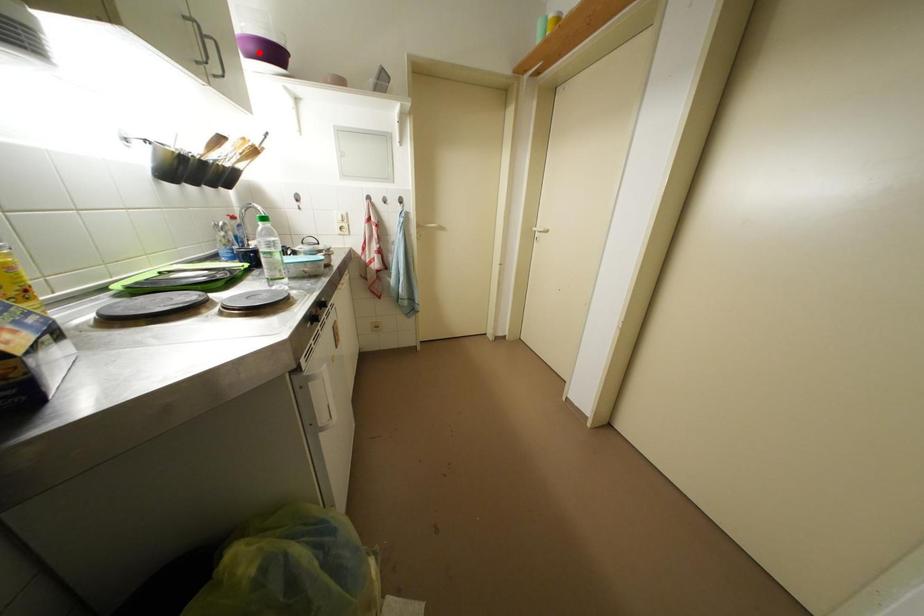
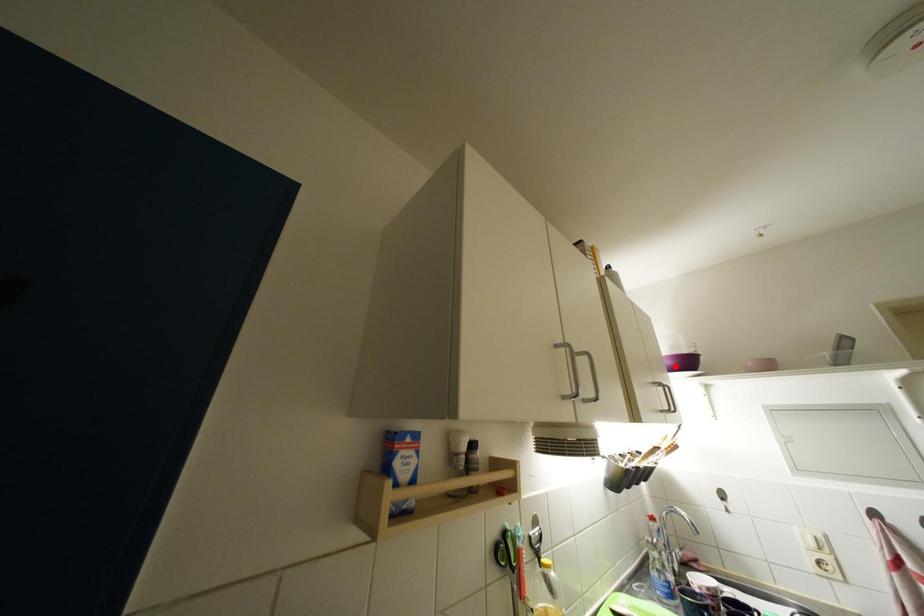
I am providing you with two images of the same scene from different viewpoints. A red point is marked on the first image and another point is marked on the second image. Do the highlighted points in image1 and image2 indicate the same real-world spot?

Yes